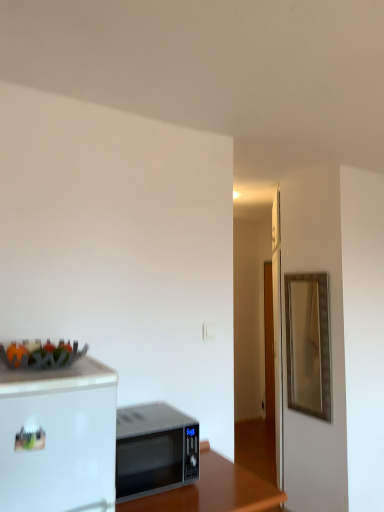
Question: In terms of size, does black glossy microwave at lower center appear bigger or smaller than silver metallic microwave at center?

Choices:
 (A) small
 (B) big

Answer: (B)

Question: Is point (238, 495) positioned closer to the camera than point (167, 465)?

Choices:
 (A) closer
 (B) farther

Answer: (B)

Question: Based on their relative distances, which object is farther from the black glossy microwave at lower center?

Choices:
 (A) silver metallic microwave at center
 (B) gold metallic mirror at right
 (C) metallic fruit basket at upper left

Answer: (B)

Question: Which object is the closest to the metallic fruit basket at upper left?

Choices:
 (A) gold metallic mirror at right
 (B) silver metallic microwave at center
 (C) black glossy microwave at lower center

Answer: (B)